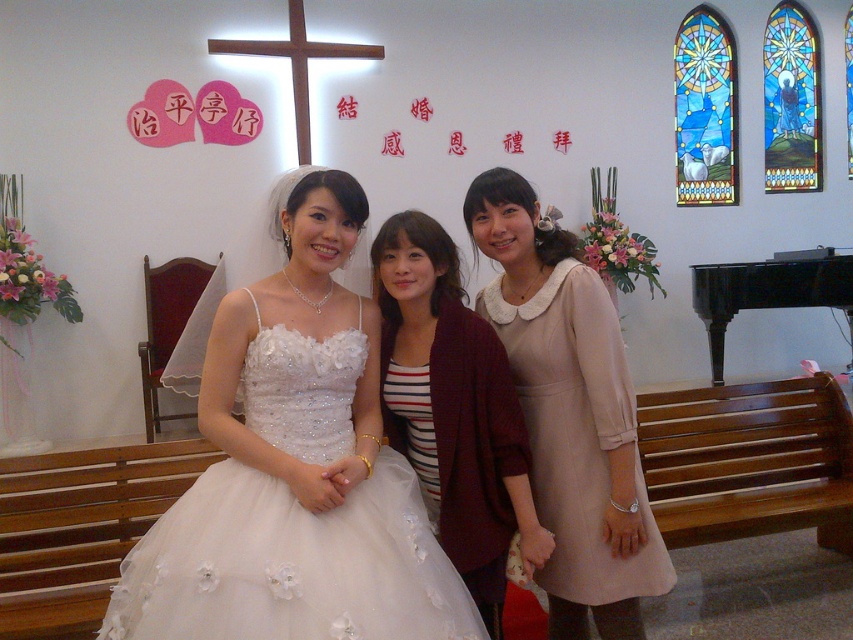
In the scene shown: You are standing at the entrance of the church and see two points marked in the image. The first point is at coordinate point (x=579, y=554) and the second point is at coordinate point (x=784, y=296). Which point is closer to you?

Point (x=579, y=554) is in front of point (x=784, y=296), so the first point is closer to you.

You are standing in front of the church scene and want to take a closer look at the white tulle dress at center. If your arm can reach 1.5 meters, can you touch it without moving your feet?

The white tulle dress at center is 1.47 meters from viewer, so yes, you can touch it with your arm since it is within reach.